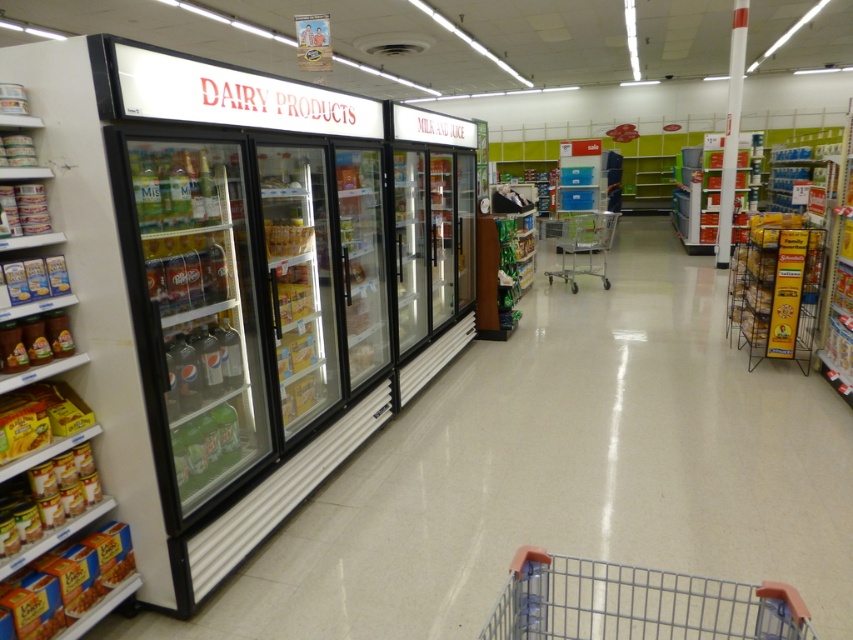
Question: Does gray metal shopping cart at lower center have a greater width compared to white plastic shelves at left?

Choices:
 (A) yes
 (B) no

Answer: (A)

Question: Does gray metal shopping cart at lower center lie in front of translucent plastic juice at center?

Choices:
 (A) yes
 (B) no

Answer: (A)

Question: Based on their relative distances, which object is nearer to the gray metal shopping cart at lower center?

Choices:
 (A) translucent plastic juice at center
 (B) shiny brown jar at lower left
 (C) metallic silver shopping cart at center
 (D) white plastic shelves at left

Answer: (D)

Question: Which is nearer to the white plastic shelves at left?

Choices:
 (A) gray metal shopping cart at lower center
 (B) translucent plastic juice at center
 (C) metallic silver shopping cart at center
 (D) shiny brown jar at lower left

Answer: (D)

Question: In this image, where is gray metal shopping cart at lower center located relative to metallic silver shopping cart at center?

Choices:
 (A) right
 (B) left

Answer: (B)

Question: Which point appears closest to the camera in this image?

Choices:
 (A) (265, 244)
 (B) (796, 593)

Answer: (B)